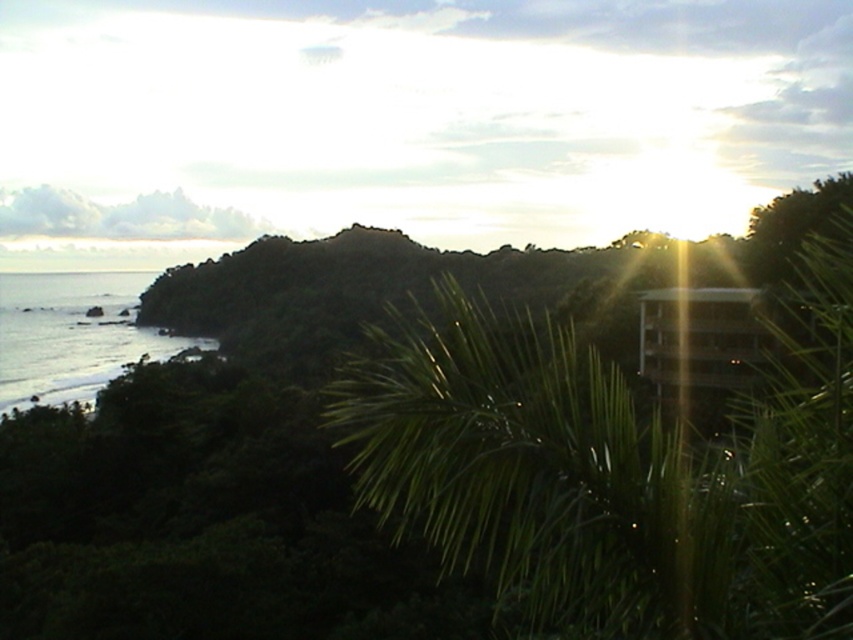
Question: Does green leafy palm tree at center have a smaller size compared to clear water at lower left?

Choices:
 (A) yes
 (B) no

Answer: (A)

Question: Which of the following is the closest to the observer?

Choices:
 (A) (61, 344)
 (B) (440, 435)

Answer: (B)

Question: Where is green leafy palm tree at center located in relation to clear water at lower left in the image?

Choices:
 (A) above
 (B) below

Answer: (B)

Question: Can you confirm if green leafy palm tree at center is positioned to the right of clear water at lower left?

Choices:
 (A) yes
 (B) no

Answer: (A)

Question: Among these points, which one is nearest to the camera?

Choices:
 (A) (39, 273)
 (B) (508, 369)

Answer: (B)